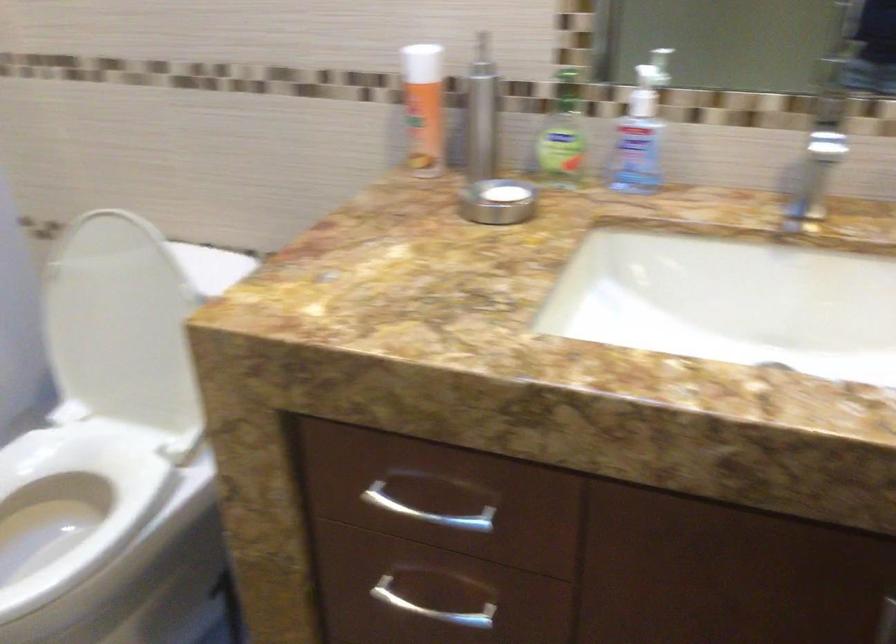
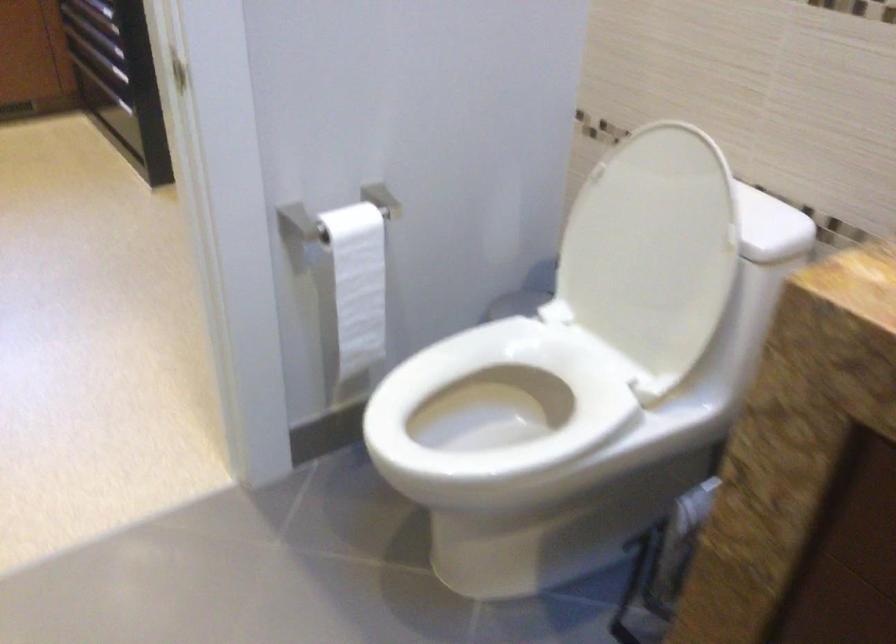
In the second image, find the point that corresponds to (136,327) in the first image.

(652, 251)